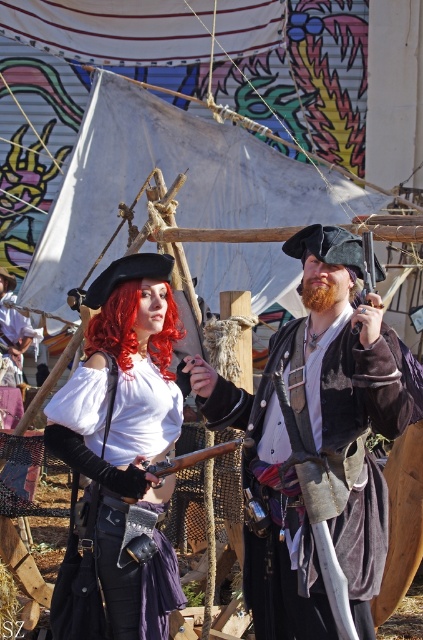
Question: Which object appears farthest from the camera in this image?

Choices:
 (A) curly red hair at center
 (B) matte white blouse at center
 (C) wooden smooth gun at center
 (D) brown leather sword at center

Answer: (A)

Question: Is matte white blouse at center thinner than wooden smooth gun at center?

Choices:
 (A) no
 (B) yes

Answer: (A)

Question: Among these points, which one is nearest to the camera?

Choices:
 (A) (249, 608)
 (B) (364, 257)

Answer: (B)

Question: Which object is farther from the camera taking this photo?

Choices:
 (A) wooden sword at center
 (B) wooden smooth gun at center
 (C) brown leather sword at center
 (D) curly red hair at center

Answer: (D)

Question: Is brown leather sword at center bigger than wooden sword at center?

Choices:
 (A) yes
 (B) no

Answer: (A)

Question: Can you confirm if matte white blouse at center is positioned to the left of wooden sword at center?

Choices:
 (A) yes
 (B) no

Answer: (A)